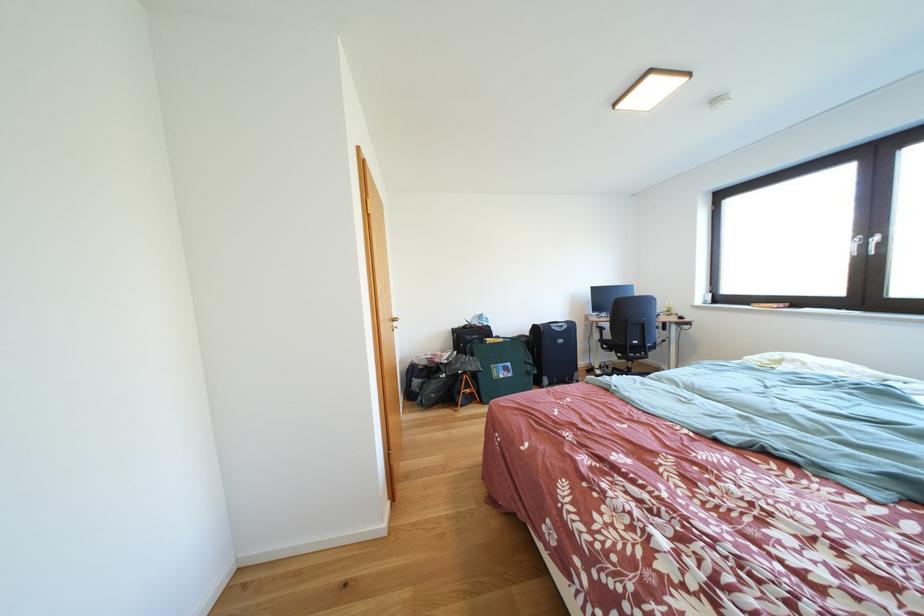
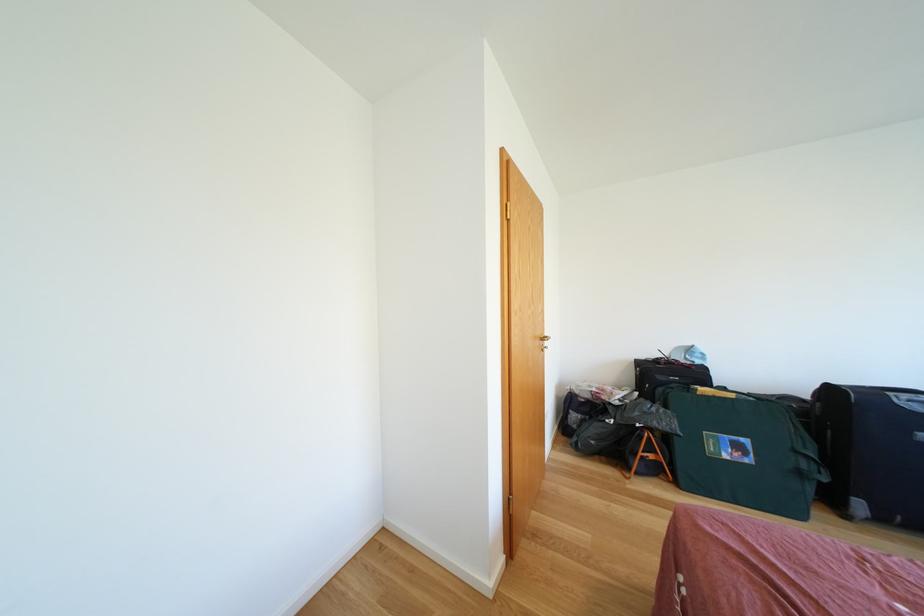
The point at (399, 328) is marked in the first image. Where is the corresponding point in the second image?

(546, 346)